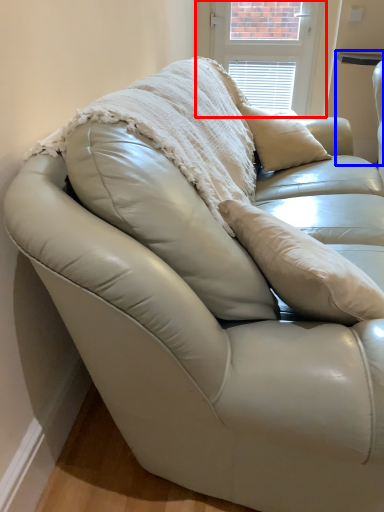
Question: Which point is further to the camera, window screen (highlighted by a red box) or table (highlighted by a blue box)?

Choices:
 (A) window screen
 (B) table

Answer: (A)